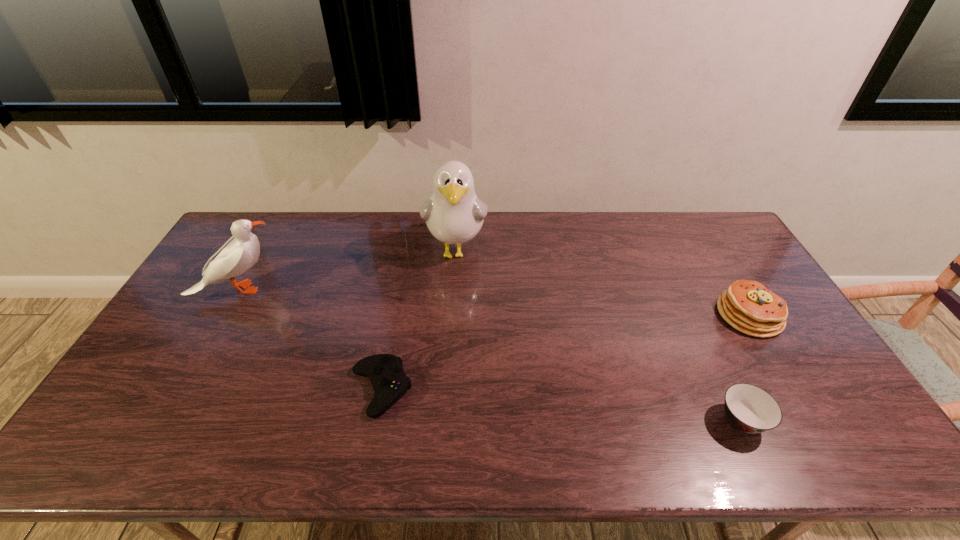
In the image, there is a desktop. At what (x,y) coordinates should I click in order to perform the action: click on vacant space at the left edge. Please return your answer as a coordinate pair (x, y). Image resolution: width=960 pixels, height=540 pixels. Looking at the image, I should click on coord(217,319).

The width and height of the screenshot is (960, 540). In the image, there is a desktop. What are the coordinates of `vacant space at the right edge` in the screenshot? It's located at [x=812, y=411].

Where is `vacant space at the far left corner of the desktop`? The height and width of the screenshot is (540, 960). vacant space at the far left corner of the desktop is located at coordinates (278, 222).

Where is `free area in between the shortest object and the fourth object from left to right`? The width and height of the screenshot is (960, 540). free area in between the shortest object and the fourth object from left to right is located at coordinates [x=562, y=405].

Where is `empty location between the right gull and the second object from right to left`? This screenshot has width=960, height=540. empty location between the right gull and the second object from right to left is located at coordinates (599, 336).

This screenshot has height=540, width=960. What are the coordinates of `vacant space that's between the shortest object and the leftmost object` in the screenshot? It's located at (310, 339).

Identify the location of empty space between the shorter gull and the taller gull. (348, 270).

Where is `free space between the second shortest object and the third tallest object`? free space between the second shortest object and the third tallest object is located at coordinates (746, 368).

Find the location of a particular element. The image size is (960, 540). vacant area that lies between the pancake and the shortest object is located at coordinates (564, 352).

Where is `empty location between the third tallest object and the leftmost object`? The height and width of the screenshot is (540, 960). empty location between the third tallest object and the leftmost object is located at coordinates (493, 302).